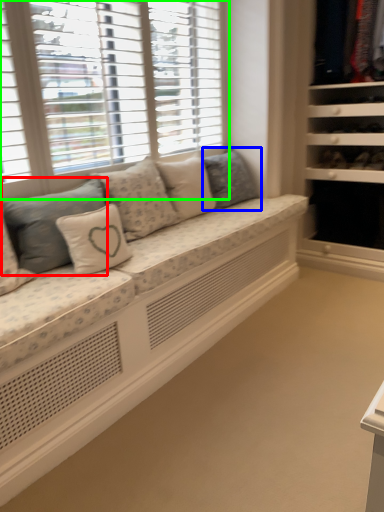
Question: Which object is the farthest from pillow (highlighted by a red box)? Choose among these: pillow (highlighted by a blue box) or window (highlighted by a green box).

Choices:
 (A) pillow
 (B) window

Answer: (A)